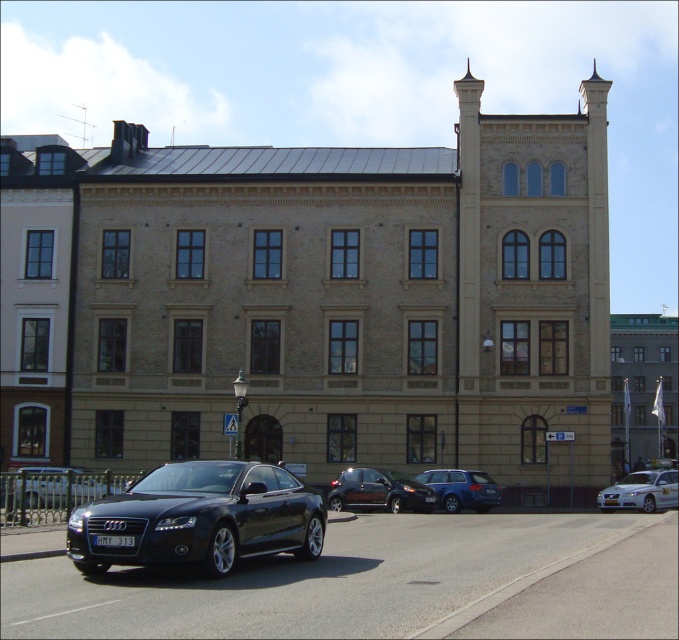
Question: Among these objects, which one is farthest from the camera?

Choices:
 (A) shiny black sedan at lower left
 (B) satin blue station wagon at center
 (C) glossy black car at center

Answer: (B)

Question: Is the position of glossy black car at center less distant than that of silver metallic sedan at lower right?

Choices:
 (A) no
 (B) yes

Answer: (B)

Question: Does glossy black car at center have a greater width compared to satin black suv at center?

Choices:
 (A) yes
 (B) no

Answer: (A)

Question: Can you confirm if silver metallic sedan at lower right is positioned above satin blue station wagon at center?

Choices:
 (A) yes
 (B) no

Answer: (B)

Question: Based on their relative distances, which object is nearer to the silver metallic sedan at lower right?

Choices:
 (A) satin blue station wagon at center
 (B) shiny black sedan at lower left
 (C) satin black suv at center
 (D) glossy black car at center

Answer: (A)

Question: Which point is farther from the camera taking this photo?

Choices:
 (A) (365, 500)
 (B) (26, 474)

Answer: (A)